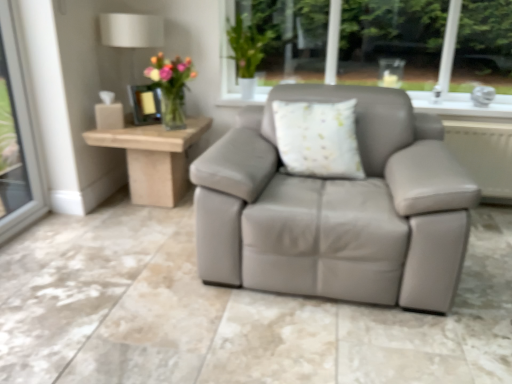
Find the location of a particular element. The image size is (512, 384). vacant location below translucent glass vase at upper left (from a real-world perspective) is located at coordinates (172, 128).